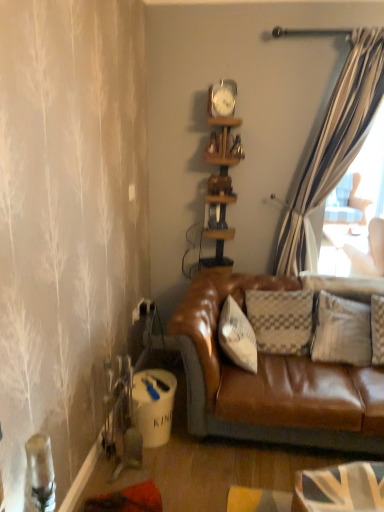
Question: Considering the relative positions of wooden clock at upper center, placed as the second shelf when sorted from bottom to top, and metallic silver clock at upper center in the image provided, is wooden clock at upper center, placed as the second shelf when sorted from bottom to top, to the left or to the right of metallic silver clock at upper center?

Choices:
 (A) left
 (B) right

Answer: (B)

Question: Do you think wooden clock at upper center, placed as the second shelf when sorted from bottom to top, is within metallic silver clock at upper center, or outside of it?

Choices:
 (A) inside
 (B) outside

Answer: (B)

Question: Considering the real-world distances, which object is closest to the wooden clock at upper center, placed as the second shelf when sorted from bottom to top?

Choices:
 (A) metallic silver clock at upper center
 (B) wooden shelf at center, which appears as the 2th shelf when viewed from the top

Answer: (A)

Question: Estimate the real-world distances between objects in this image. Which object is closer to the wooden clock at upper center, placed as the second shelf when sorted from bottom to top?

Choices:
 (A) wooden shelf at center, the first shelf in the bottom-to-top sequence
 (B) metallic silver clock at upper center

Answer: (B)